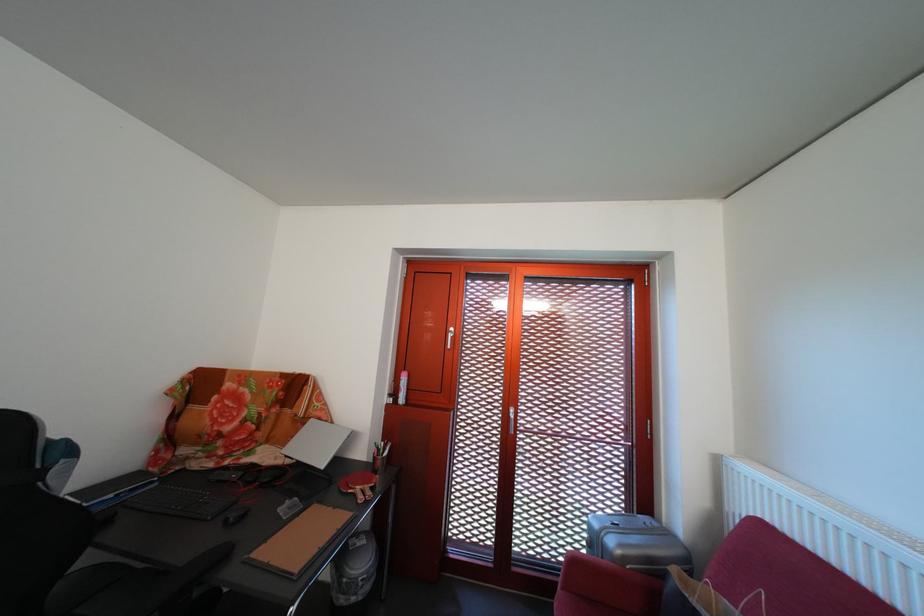
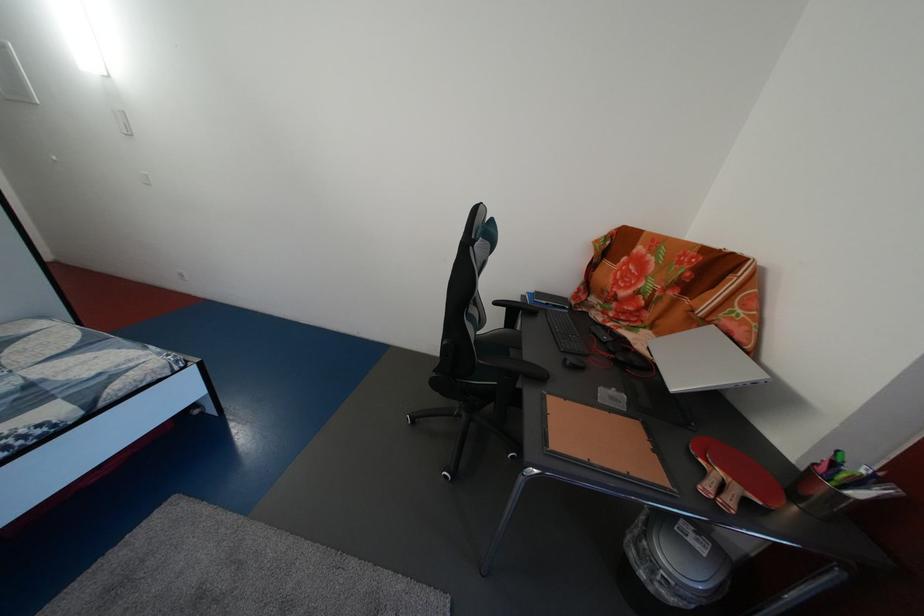
The point at (378,493) is marked in the first image. Where is the corresponding point in the second image?

(748, 496)